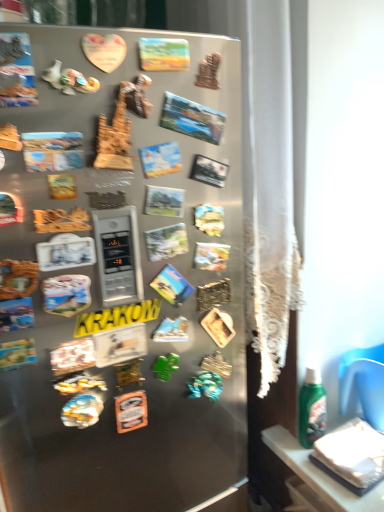
Question: Considering the positions of point (177, 202) and point (354, 417), is point (177, 202) closer or farther from the camera than point (354, 417)?

Choices:
 (A) farther
 (B) closer

Answer: (B)

Question: In the image, is matte paper comic book at center, which is counted as the third comic book, starting from the bottom, positioned in front of or behind white paper at lower right?

Choices:
 (A) behind
 (B) front

Answer: (B)

Question: Which object is positioned closest to the matte plastic comic book at upper left, the 4th comic book from the top?

Choices:
 (A) pastel painted canvas at upper center, positioned as the 8th comic book in bottom-to-top order
 (B) green matte comic book at center, the seventh comic book viewed from the top
 (C) green glossy bottle at lower right
 (D) white paper at lower right
 (E) yellow matte sign at center

Answer: (A)

Question: Which object is positioned closest to the matte plastic comic book at upper center, placed as the second comic book when sorted from top to bottom?

Choices:
 (A) green plastic magnet at center
 (B) white paper at lower right
 (C) matte plastic comic book at center, arranged as the third comic book when viewed from the top
 (D) black matte comic book at center, the fifth comic book positioned from the top
 (E) matte paper comic book at center, marked as the 6th comic book in a top-to-bottom arrangement

Answer: (C)